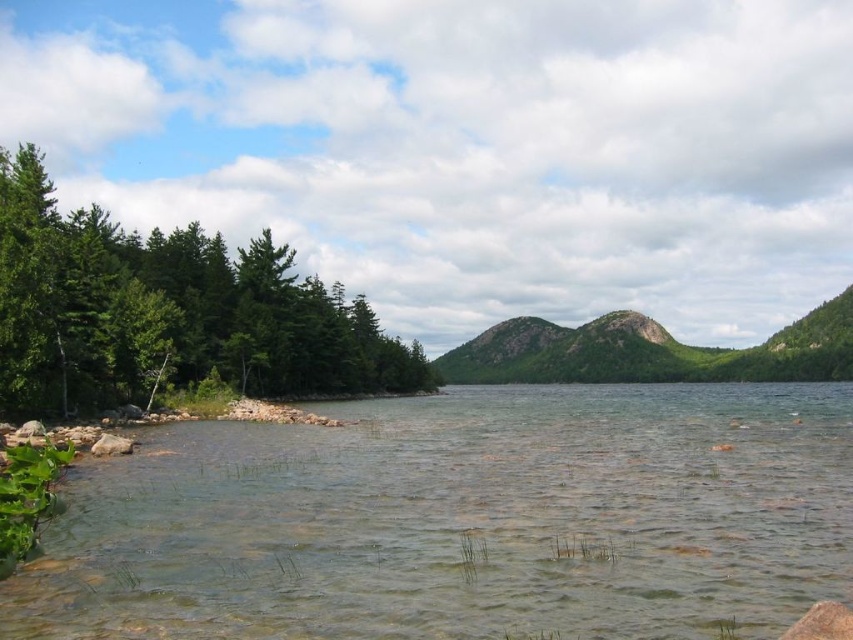
Which is more to the left, clear water at lower left or green textured rock at center?

From the viewer's perspective, clear water at lower left appears more on the left side.

Is clear water at lower left smaller than green textured rock at center?

Correct, clear water at lower left occupies less space than green textured rock at center.

Where is `clear water at lower left`? The width and height of the screenshot is (853, 640). clear water at lower left is located at coordinates (462, 520).

Which is more to the right, green leafy trees at left or green textured rock at center?

Positioned to the right is green textured rock at center.

Is green leafy trees at left positioned in front of green textured rock at center?

Yes, green leafy trees at left is in front of green textured rock at center.

You are a GUI agent. You are given a task and a screenshot of the screen. Output one action in this format:
    pyautogui.click(x=<x>, y=<y>)
    Task: Click on the green leafy trees at left
    The height and width of the screenshot is (640, 853).
    Given the screenshot: What is the action you would take?
    pyautogui.click(x=167, y=312)

Can you confirm if clear water at lower left is thinner than green leafy trees at left?

No.

Can you confirm if clear water at lower left is wider than green leafy trees at left?

Yes, clear water at lower left is wider than green leafy trees at left.

Is point (514, 522) farther from viewer compared to point (271, 333)?

No, it is not.

Identify the location of clear water at lower left. This screenshot has height=640, width=853. (462, 520).